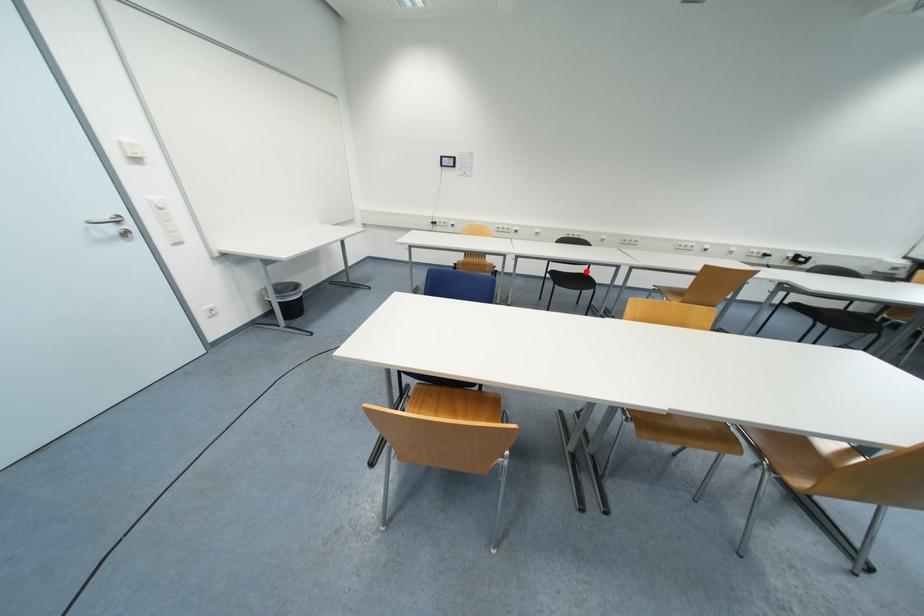
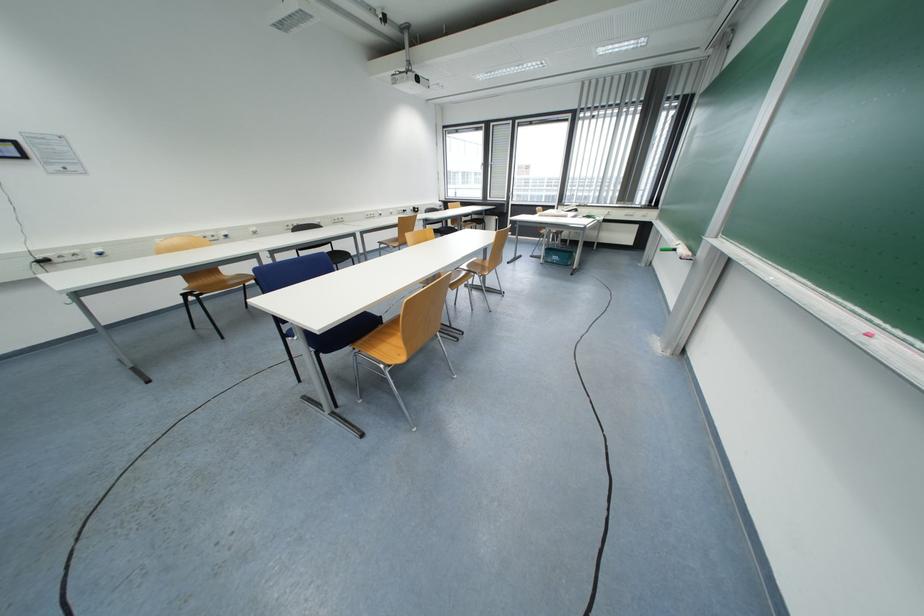
Question: I am providing you with two images of the same scene from different viewpoints. A red point is marked on the first image. Is the red point's position out of view in image 2?

Choices:
 (A) Yes
 (B) No

Answer: (B)